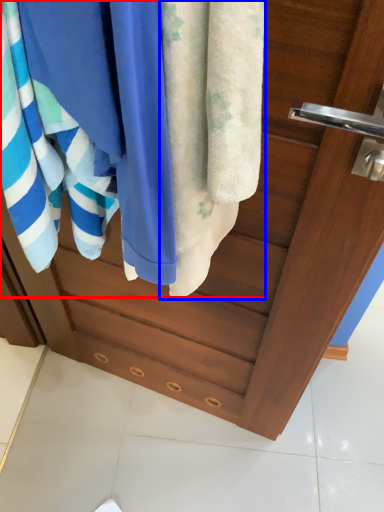
Question: Which object appears closest to the camera in this image, beach towel (highlighted by a red box) or towel (highlighted by a blue box)?

Choices:
 (A) beach towel
 (B) towel

Answer: (B)